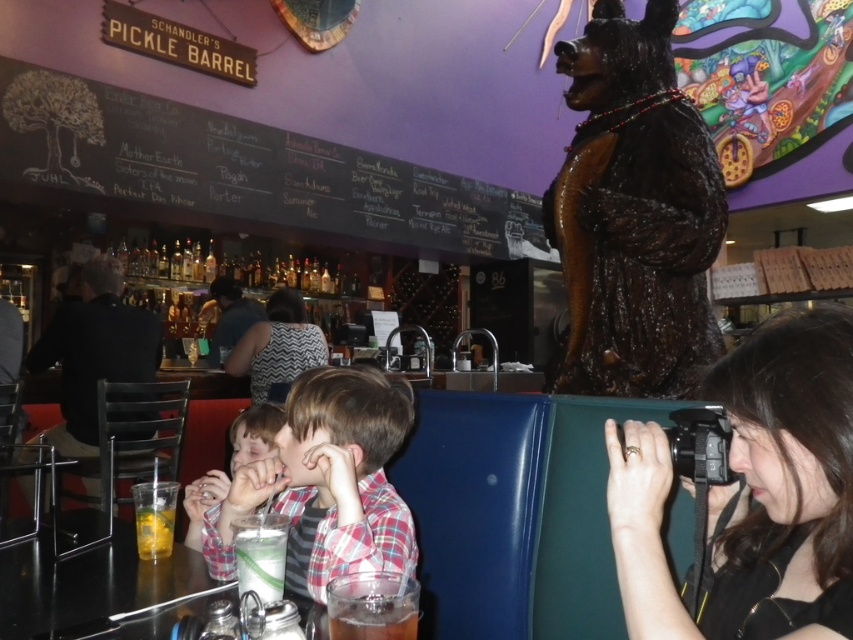
Question: Does black fabric camera at right have a larger size compared to black chalkboard menu at upper center?

Choices:
 (A) yes
 (B) no

Answer: (B)

Question: Can you confirm if shiny brown fur at right is positioned to the left of smooth skin child at center?

Choices:
 (A) no
 (B) yes

Answer: (A)

Question: Which of the following is the farthest from the observer?

Choices:
 (A) clear glass cup at center
 (B) black chalkboard menu at upper center
 (C) black fabric camera at right

Answer: (B)

Question: Can you confirm if shiny brown fur at right is smaller than black leather jacket at left?

Choices:
 (A) no
 (B) yes

Answer: (A)

Question: Estimate the real-world distances between objects in this image. Which object is farther from the patterned fabric dress at center?

Choices:
 (A) black leather jacket at left
 (B) black chalkboard menu at upper center
 (C) clear glass cup at center

Answer: (C)

Question: Considering the real-world distances, which object is closest to the translucent plastic cup at lower center?

Choices:
 (A) smooth skin child at center
 (B) patterned fabric dress at center
 (C) shiny brown fur at right
 (D) clear glass cup at center

Answer: (D)